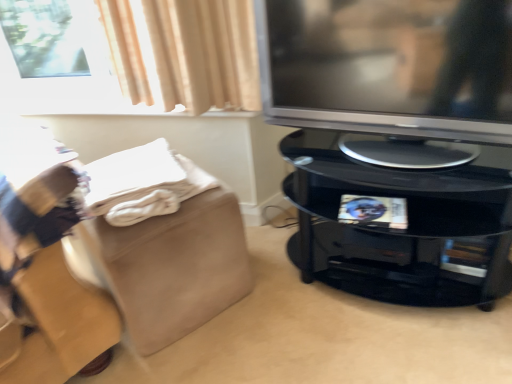
The image size is (512, 384). I want to click on blank area to the left of glossy black tv stand at right, so click(x=266, y=311).